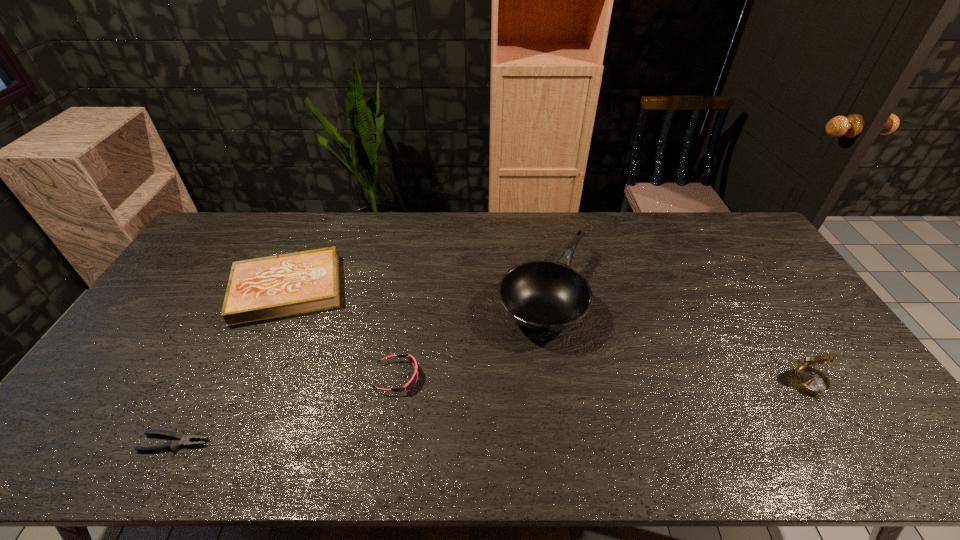
Locate an element on the screen. This screenshot has width=960, height=540. object that stands as the second closest to the rightmost object is located at coordinates (412, 382).

You are a GUI agent. You are given a task and a screenshot of the screen. Output one action in this format:
    pyautogui.click(x=<x>, y=<y>)
    Task: Click on the free space in the image that satisfies the following two spatial constraints: 1. on the front side of the third shortest object; 2. on the right side of the second object from right to left
    The width and height of the screenshot is (960, 540).
    Given the screenshot: What is the action you would take?
    pyautogui.click(x=285, y=295)

Identify the location of vacant space that satisfies the following two spatial constraints: 1. on the front side of the frying pan; 2. on the left side of the third shortest object. (285, 295).